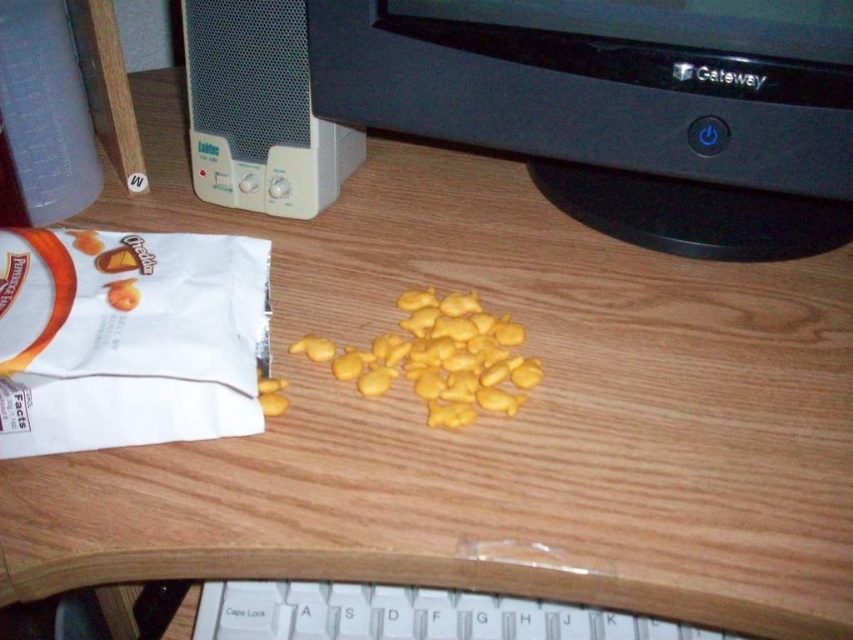
You are organizing your desk and need to place a new item between the black plastic computer monitor at upper center and the white plastic keyboard at lower center. Based on their sizes, which object should you place closer to the edge to ensure stability?

The black plastic computer monitor at upper center is bigger than the white plastic keyboard at lower center, so placing the larger monitor closer to the edge would provide better stability due to its weight and size.

You need to place a rectangular box that is 15 inches wide on the desk. Given the black plastic computer monitor at upper center and the white plastic keyboard at lower center, which object can the box be placed next to without overlapping?

The black plastic computer monitor at upper center has a greater width than the white plastic keyboard at lower center. Since the box is 15 inches wide, it can be placed next to the white plastic keyboard at lower center as it is narrower and less likely to cause overlap.